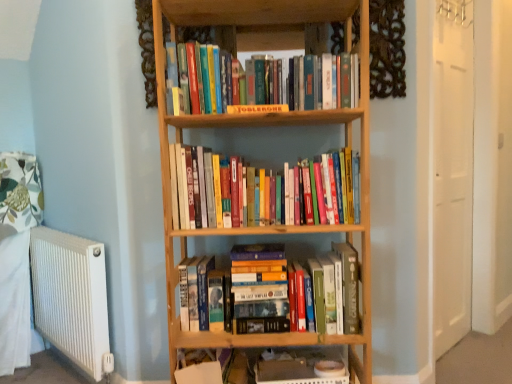
Question: From a real-world perspective, is wooden shelf at lower center physically located above or below hardcover books at center, placed as the first book when sorted from bottom to top?

Choices:
 (A) below
 (B) above

Answer: (A)

Question: Based on their sizes in the image, would you say wooden shelf at lower center is bigger or smaller than hardcover books at center, placed as the first book when sorted from bottom to top?

Choices:
 (A) small
 (B) big

Answer: (A)

Question: Based on their relative distances, which object is farther from the hardcover books at center, placed as the first book when sorted from bottom to top?

Choices:
 (A) white metallic radiator at left
 (B) matte yellow book at center
 (C) hardcover books at upper center, the 1th book when ordered from top to bottom
 (D) hardcover books at center, the second book from the bottom
 (E) wooden shelf at lower center

Answer: (A)

Question: Considering the real-world distances, which object is closest to the wooden shelf at lower center?

Choices:
 (A) natural wood bookcase at center
 (B) hardcover books at upper center, placed as the 3th book when sorted from bottom to top
 (C) hardcover books at center, the second book in the top-to-bottom sequence
 (D) matte yellow book at center
 (E) white metallic radiator at left

Answer: (A)